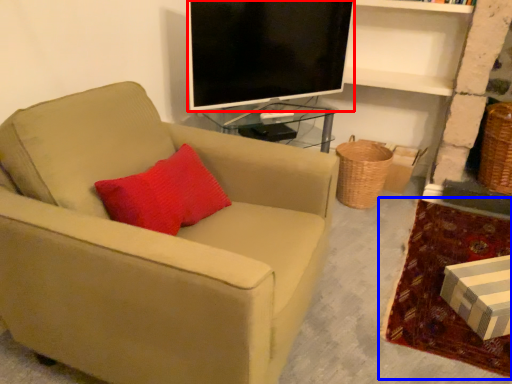
Question: Which object appears farthest to the camera in this image, television (highlighted by a red box) or plain (highlighted by a blue box)?

Choices:
 (A) television
 (B) plain

Answer: (A)